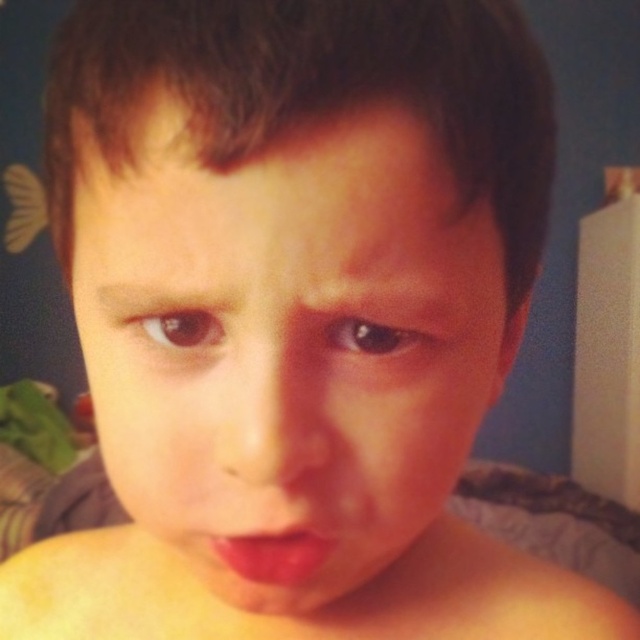
Is smooth skin face at center above matte pink lips at center?

Yes, smooth skin face at center is above matte pink lips at center.

Measure the distance from smooth skin face at center to matte pink lips at center.

smooth skin face at center and matte pink lips at center are 2.40 inches apart from each other.

Which is behind, point (392, 241) or point (296, 580)?

The point (296, 580) is more distant.

In order to click on smooth skin face at center in this screenshot , I will do `click(289, 340)`.